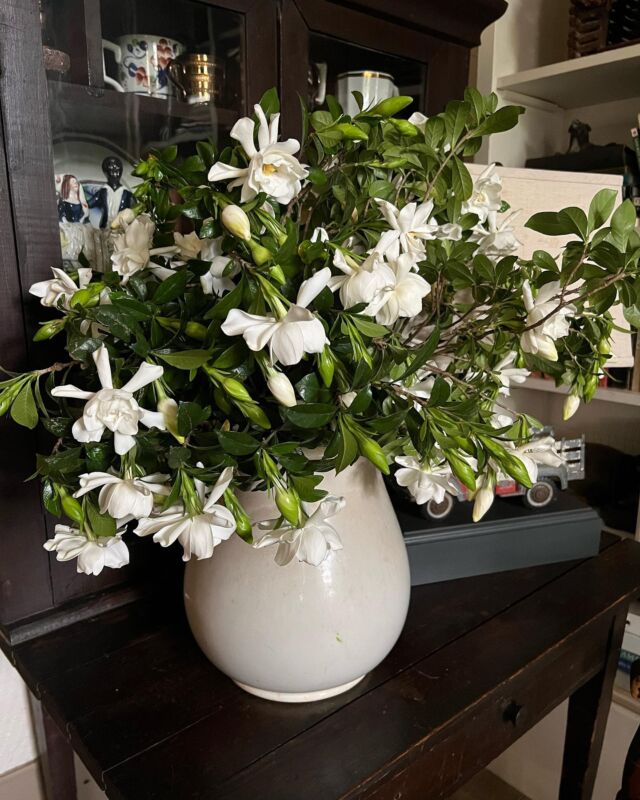
The height and width of the screenshot is (800, 640). What are the coordinates of `bronze striped mug` in the screenshot? It's located at (200, 68).